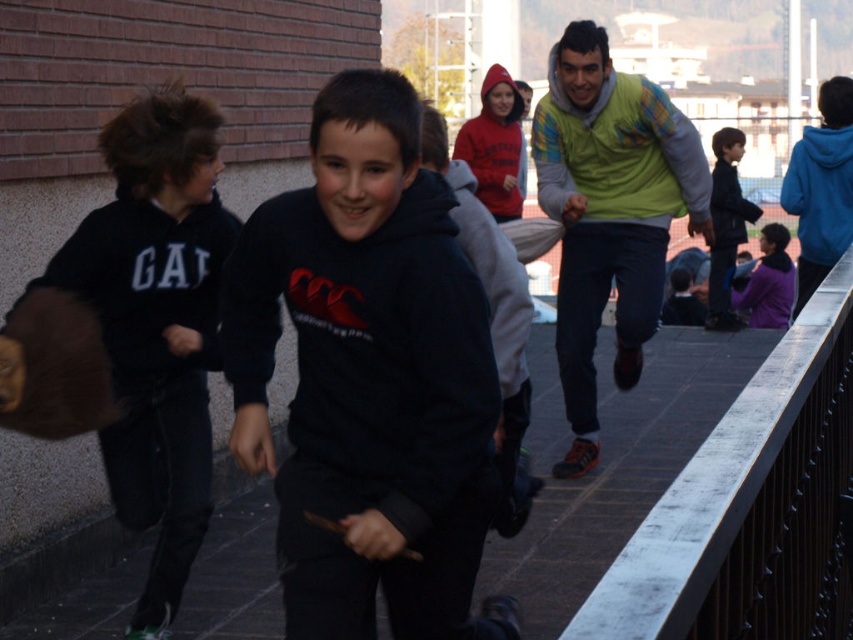
Question: Does black hoodie at center appear on the left side of metallic gray rail at upper right?

Choices:
 (A) yes
 (B) no

Answer: (A)

Question: Which point is closer to the camera taking this photo?

Choices:
 (A) (122, 442)
 (B) (608, 237)
 (C) (601, 490)
 (D) (503, 198)

Answer: (A)

Question: Considering the real-world distances, which object is farthest from the black fleece jacket at upper right?

Choices:
 (A) red fleece hoodie at center
 (B) green sweater at center
 (C) metallic gray rail at upper right

Answer: (C)

Question: Does metallic gray rail at upper right have a lesser width compared to green sweater at center?

Choices:
 (A) yes
 (B) no

Answer: (B)

Question: Which of the following is the closest to the observer?

Choices:
 (A) green fleece sweatshirt at upper right
 (B) red fleece hoodie at center
 (C) black asphalt pavement at center
 (D) black fleece jacket at left

Answer: (D)

Question: Observing the image, what is the correct spatial positioning of black asphalt pavement at center in reference to red fleece hoodie at center?

Choices:
 (A) above
 (B) below

Answer: (B)